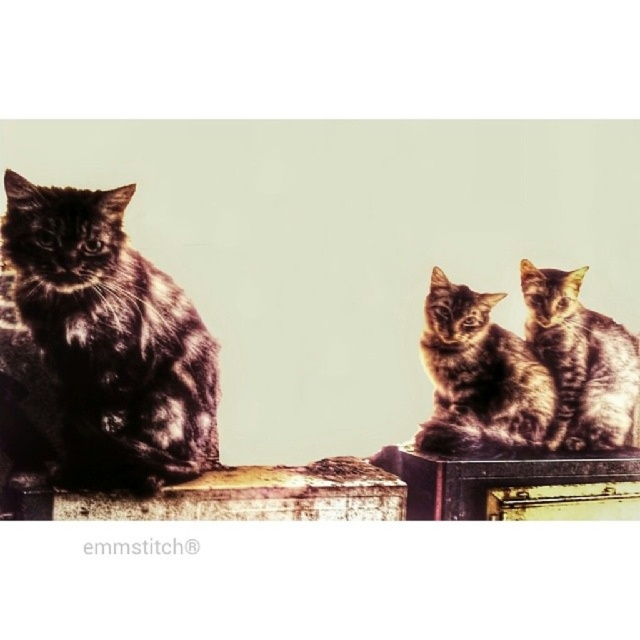
Question: Does shiny black cat at left have a lesser width compared to shiny brown fur at center?

Choices:
 (A) no
 (B) yes

Answer: (A)

Question: In this image, where is shiny black cat at left located relative to shiny brown fur at center?

Choices:
 (A) right
 (B) left

Answer: (B)

Question: Which of the following is the closest to the observer?

Choices:
 (A) (467, 288)
 (B) (609, 403)
 (C) (58, 257)

Answer: (C)

Question: Among these objects, which one is farthest from the camera?

Choices:
 (A) tabby fur cat at right
 (B) shiny brown fur at center
 (C) shiny black cat at left

Answer: (A)

Question: Based on their relative distances, which object is farther from the shiny brown fur at center?

Choices:
 (A) shiny black cat at left
 (B) tabby fur cat at right

Answer: (A)

Question: Does shiny black cat at left have a larger size compared to shiny brown fur at center?

Choices:
 (A) yes
 (B) no

Answer: (A)